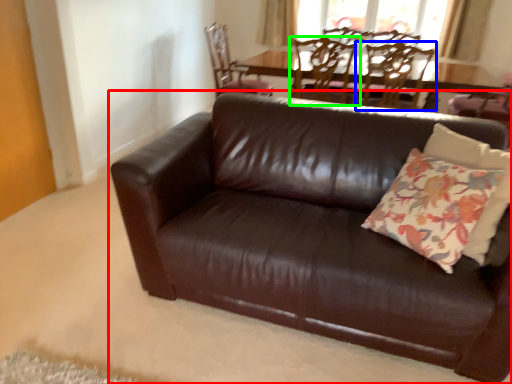
Question: Based on their relative distances, which object is farther from studio couch (highlighted by a red box)? Choose from chair (highlighted by a blue box) and chair (highlighted by a green box).

Choices:
 (A) chair
 (B) chair

Answer: (A)